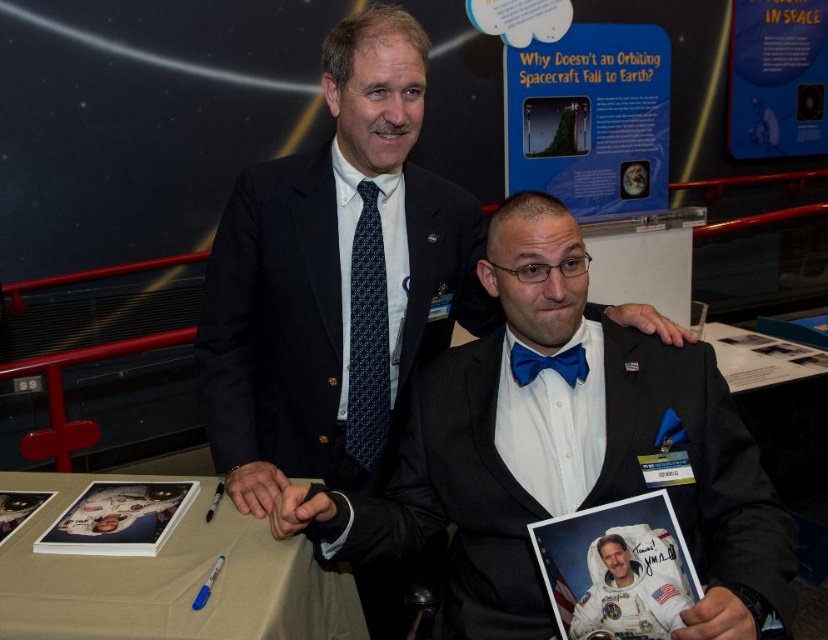
Is beige fabric table at lower center closer to the viewer compared to matte paper poster at upper center?

Yes, it is in front of matte paper poster at upper center.

Measure the distance between point (355, 609) and camera.

Point (355, 609) is 1.40 meters from camera.

What do you see at coordinates (169, 579) in the screenshot?
I see `beige fabric table at lower center` at bounding box center [169, 579].

At what (x,y) coordinates should I click in order to perform the action: click on beige fabric table at lower center. Please return your answer as a coordinate pair (x, y). The width and height of the screenshot is (828, 640). Looking at the image, I should click on (169, 579).

Which is behind, point (513, 516) or point (591, 33)?

The point (591, 33) is behind.

Which is in front, point (465, 456) or point (525, 106)?

Point (465, 456) is in front.

Who is more distant from viewer, (386, 547) or (591, 160)?

Point (591, 160)

Where is `black satin business suit at center`? black satin business suit at center is located at coordinates (579, 490).

Between matte paper poster at upper center and blue satin bow tie at center, which one is positioned higher?

matte paper poster at upper center

Between matte paper poster at upper center and blue satin bow tie at center, which one appears on the right side from the viewer's perspective?

From the viewer's perspective, matte paper poster at upper center appears more on the right side.

Measure the distance between point (x=593, y=164) and camera.

Point (x=593, y=164) and camera are 10.05 feet apart from each other.

Locate an element on the screen. This screenshot has width=828, height=640. matte paper poster at upper center is located at coordinates (590, 116).